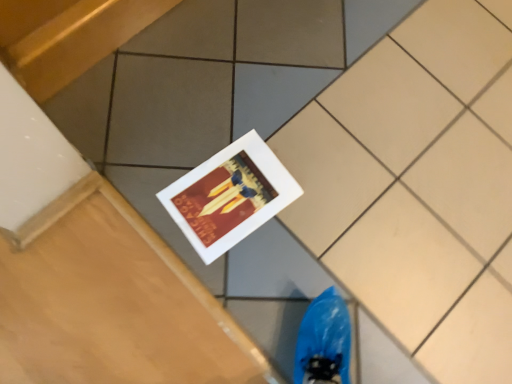
Locate an element on the screen. vacant location behind white matte picture frame at center is located at coordinates (263, 112).